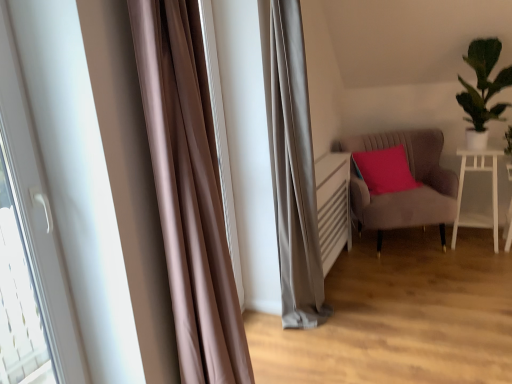
The height and width of the screenshot is (384, 512). In order to click on vacant space positioned to the left of white glossy table at right in this screenshot , I will do `click(434, 248)`.